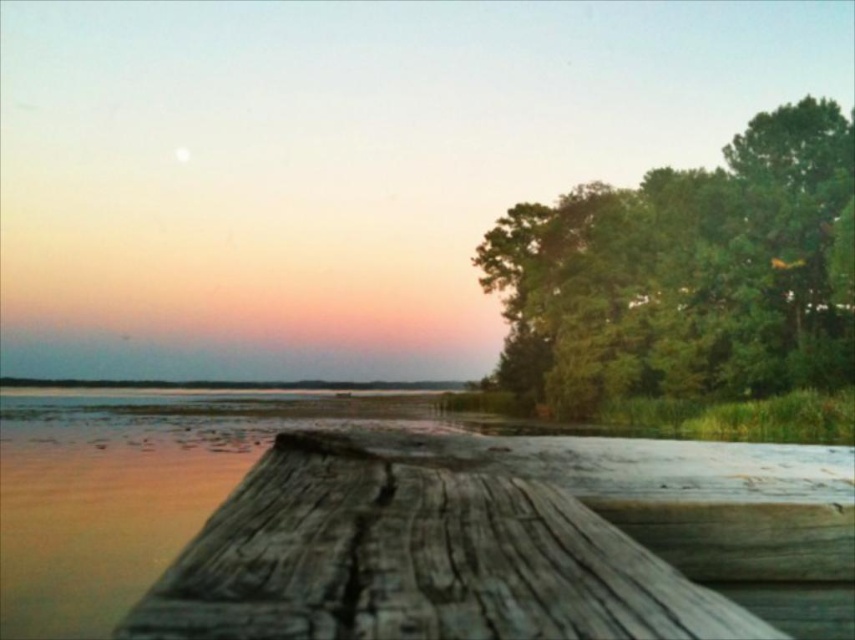
Locate an element on the screen. This screenshot has width=855, height=640. weathered wood dock at center is located at coordinates (417, 554).

You are a GUI agent. You are given a task and a screenshot of the screen. Output one action in this format:
    pyautogui.click(x=<x>, y=<y>)
    Task: Click on the weathered wood dock at center
    This screenshot has width=855, height=640.
    Given the screenshot: What is the action you would take?
    pyautogui.click(x=417, y=554)